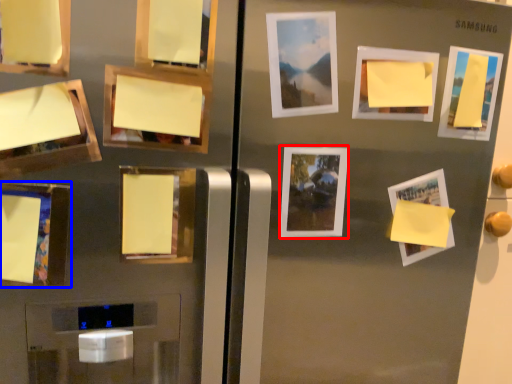
Question: Among these objects, which one is farthest to the camera, picture frame (highlighted by a red box) or picture frame (highlighted by a blue box)?

Choices:
 (A) picture frame
 (B) picture frame

Answer: (A)